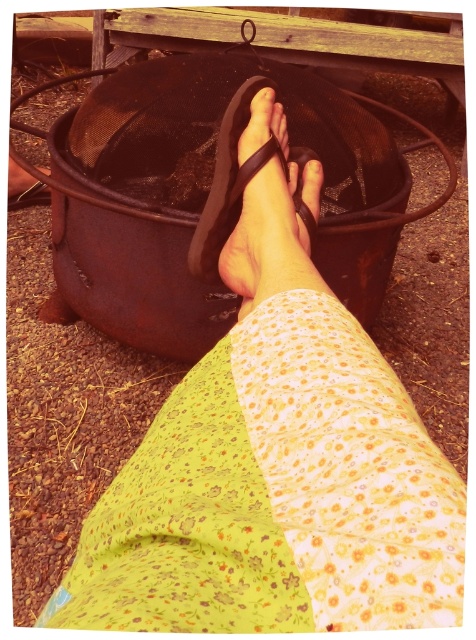
You are a photographer trying to capture a close shot of the black rubber sandal at center and the matte black toe at center. The camera lens can only focus on objects within a 2 inch range. Will both objects be in focus?

The black rubber sandal at center and matte black toe at center are 2.39 inches apart from each other, which exceeds the camera lens focus range of 2 inches. Therefore, both objects cannot be in focus simultaneously.

You are trying to determine if your sandal can cover your toe completely. Based on the image, can the black rubber sandal at center completely cover the matte black toe at center?

The black rubber sandal at center is taller than the matte black toe at center, so yes, the sandal can completely cover the toe.